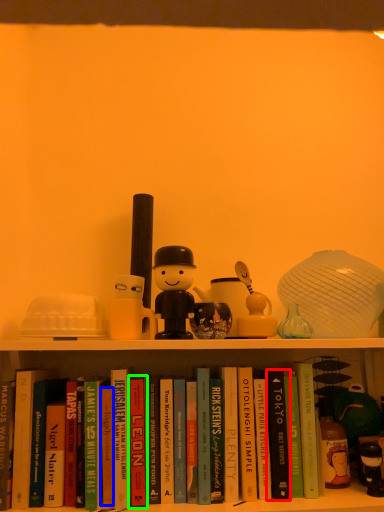
Question: Which object is the farthest from paperback book (highlighted by a red box)? Choose among these: paperback book (highlighted by a blue box) or paperback book (highlighted by a green box).

Choices:
 (A) paperback book
 (B) paperback book

Answer: (A)